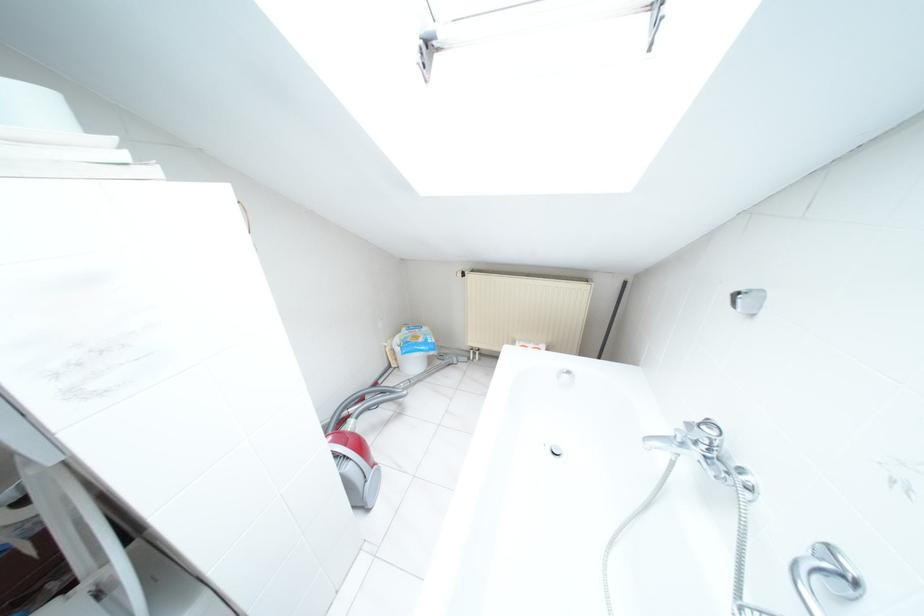
Identify the location of faucet handle. The image size is (924, 616). (694, 445).